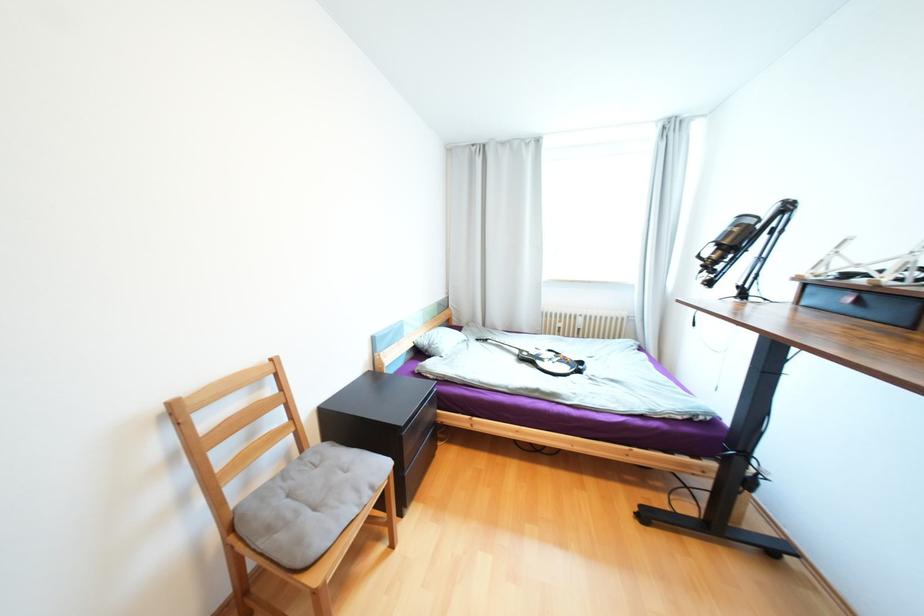
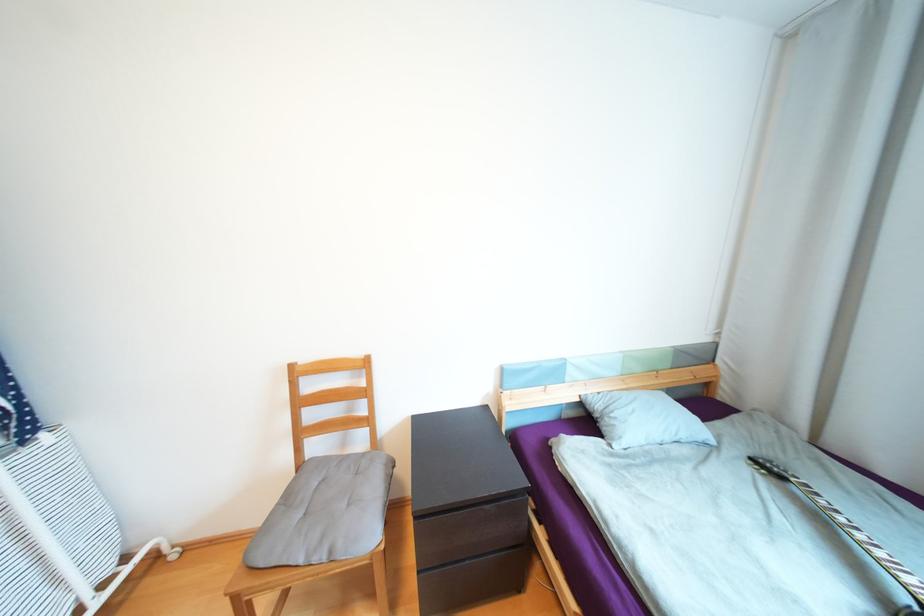
Question: The first image is from the beginning of the video and the second image is from the end. How did the camera likely rotate when shooting the video?

Choices:
 (A) Left
 (B) Right
 (C) Up
 (D) Down

Answer: (A)